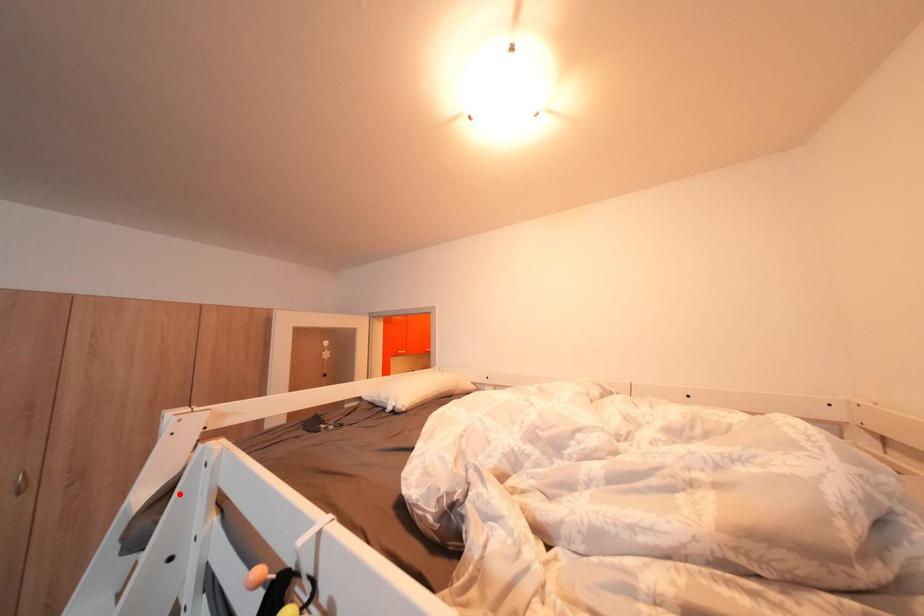
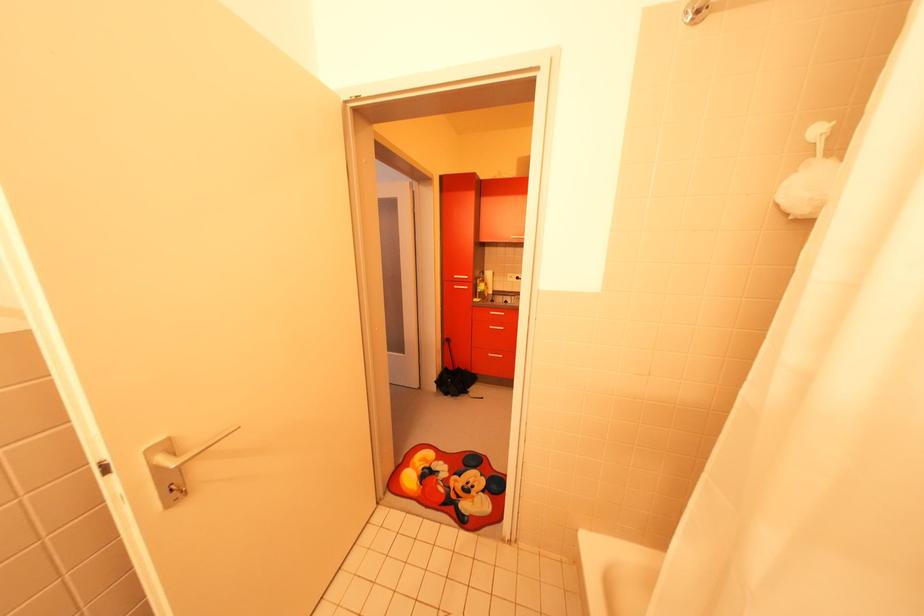
Question: I am providing you with two images of the same scene from different viewpoints. A red point is marked on the first image. Can you still see the location of the red point in image 2?

Choices:
 (A) Yes
 (B) No

Answer: (B)